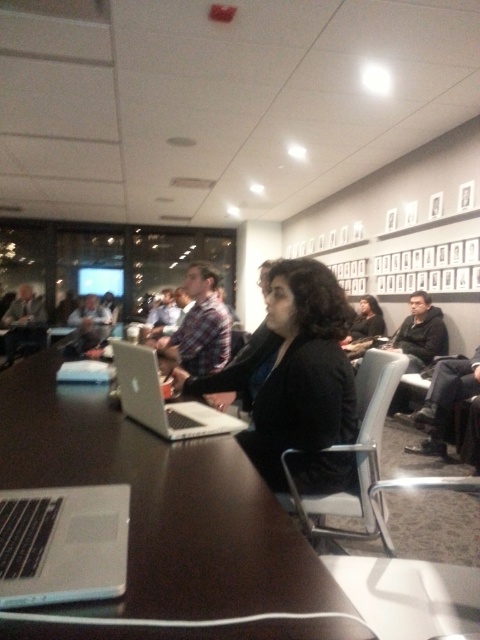
Consider the image. Is dark wood table at center bigger than silver metallic laptop at lower left?

Indeed, dark wood table at center has a larger size compared to silver metallic laptop at lower left.

Can you confirm if dark wood table at center is positioned above silver metallic laptop at lower left?

Indeed, dark wood table at center is positioned over silver metallic laptop at lower left.

Who is more forward, (x=48, y=424) or (x=3, y=572)?

Point (x=3, y=572) is in front.

Where is `dark wood table at center`? dark wood table at center is located at coordinates (166, 525).

Identify the location of dark wood table at center. (166, 525).

Between dark wood table at center and black matte jacket at center, which one has more height?

black matte jacket at center is taller.

Image resolution: width=480 pixels, height=640 pixels. Describe the element at coordinates (166, 525) in the screenshot. I see `dark wood table at center` at that location.

This screenshot has width=480, height=640. Find the location of `dark wood table at center`. dark wood table at center is located at coordinates (166, 525).

Is dark wood table at center positioned behind white plastic chair at center?

No, dark wood table at center is closer to the viewer.

Who is positioned more to the left, dark wood table at center or white plastic chair at center?

From the viewer's perspective, dark wood table at center appears more on the left side.

Which is in front, point (315, 554) or point (381, 381)?

Point (315, 554)

The image size is (480, 640). What are the coordinates of `dark wood table at center` in the screenshot? It's located at (166, 525).